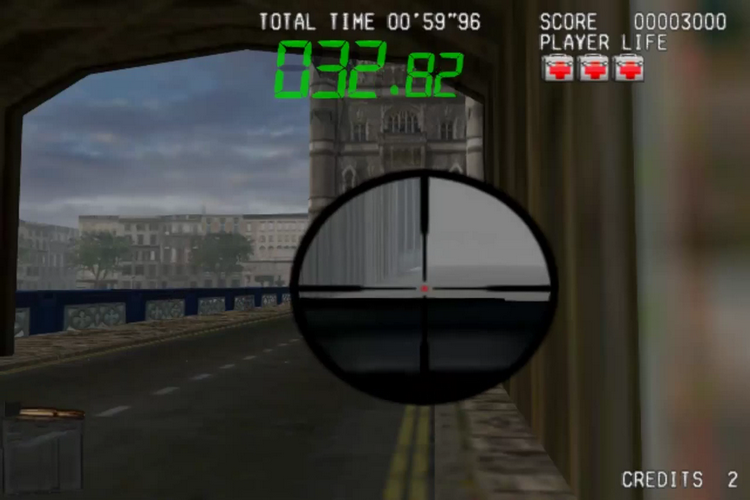
Image resolution: width=750 pixels, height=500 pixels. Find the location of `side rails`. side rails is located at coordinates [106, 295].